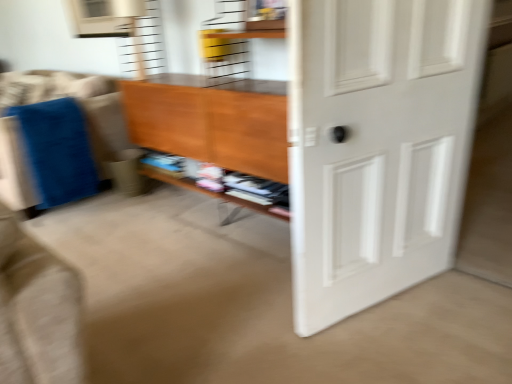
Measure the distance between point (402, 82) and camera.

The distance of point (402, 82) from camera is 4.65 feet.

At what (x,y) coordinates should I click in order to perform the action: click on white matte door at right. Please return your answer as a coordinate pair (x, y). The image size is (512, 384). Looking at the image, I should click on [377, 145].

Image resolution: width=512 pixels, height=384 pixels. What do you see at coordinates (377, 145) in the screenshot? I see `white matte door at right` at bounding box center [377, 145].

The image size is (512, 384). I want to click on wooden shelf at center, so click(212, 194).

In order to face wooden shelf at center, should I rotate leftwards or rightwards?

To face it directly, rotate left by 5.669 degrees.

The image size is (512, 384). Describe the element at coordinates (212, 194) in the screenshot. I see `wooden shelf at center` at that location.

You are a GUI agent. You are given a task and a screenshot of the screen. Output one action in this format:
    pyautogui.click(x=<x>, y=<y>)
    Task: Click on the white matte door at right
    Image resolution: width=512 pixels, height=384 pixels.
    Given the screenshot: What is the action you would take?
    pyautogui.click(x=377, y=145)

Which object is positioned more to the left, white matte door at right or wooden shelf at center?

wooden shelf at center is more to the left.

Which object is further away from the camera, white matte door at right or wooden shelf at center?

wooden shelf at center is further away from the camera.

Which is in front, point (403, 67) or point (228, 219)?

The point (403, 67) is closer to the camera.

From the image's perspective, between white matte door at right and wooden shelf at center, who is located below?

white matte door at right, from the image's perspective.

From a real-world perspective, is white matte door at right on wooden shelf at center?

Yes, from a real-world perspective, white matte door at right is above wooden shelf at center.

Between white matte door at right and wooden shelf at center, which one has smaller width?

With smaller width is white matte door at right.

Is white matte door at right taller or shorter than wooden shelf at center?

Clearly, white matte door at right is taller compared to wooden shelf at center.

Looking at this image, between white matte door at right and wooden shelf at center, which one has smaller size?

wooden shelf at center.

Is white matte door at right inside or outside of wooden shelf at center?

white matte door at right lies outside wooden shelf at center.

Would you consider white matte door at right to be distant from wooden shelf at center?

No.

Is white matte door at right looking in the opposite direction of wooden shelf at center?

Absolutely, white matte door at right is directed away from wooden shelf at center.

From the picture: How much distance is there between white matte door at right and wooden shelf at center?

The distance of white matte door at right from wooden shelf at center is 31.00 inches.

Locate an element on the screen. This screenshot has width=512, height=384. door in front of the wooden shelf at center is located at coordinates (377, 145).

Between wooden shelf at center and white matte door at right, which one appears on the right side from the viewer's perspective?

From the viewer's perspective, white matte door at right appears more on the right side.

Is wooden shelf at center in front of or behind white matte door at right in the image?

wooden shelf at center is positioned farther from the viewer than white matte door at right.

Does point (166, 172) appear closer or farther from the camera than point (300, 74)?

Point (166, 172) appears to be farther away from the viewer than point (300, 74).

From the image's perspective, which is below, wooden shelf at center or white matte door at right?

white matte door at right, from the image's perspective.

Based on the photo, from a real-world perspective, is wooden shelf at center beneath white matte door at right?

Correct, in the physical world, wooden shelf at center is lower than white matte door at right.

Considering the relative sizes of wooden shelf at center and white matte door at right in the image provided, is wooden shelf at center wider than white matte door at right?

Indeed, wooden shelf at center has a greater width compared to white matte door at right.

Can you confirm if wooden shelf at center is taller than white matte door at right?

No.

Looking at this image, who is smaller, wooden shelf at center or white matte door at right?

wooden shelf at center.

Do you think wooden shelf at center is within white matte door at right, or outside of it?

wooden shelf at center is outside white matte door at right.

Is wooden shelf at center beside white matte door at right?

No, wooden shelf at center is not touching white matte door at right.

Is wooden shelf at center oriented away from white matte door at right?

No, wooden shelf at center's orientation is not away from white matte door at right.

Where is `door that is above the wooden shelf at center (from a real-world perspective)`? door that is above the wooden shelf at center (from a real-world perspective) is located at coordinates (377, 145).

This screenshot has width=512, height=384. I want to click on shelf below the white matte door at right (from a real-world perspective), so click(212, 194).

This screenshot has height=384, width=512. There is a wooden shelf at center. Identify the location of door above it (from a real-world perspective). (377, 145).